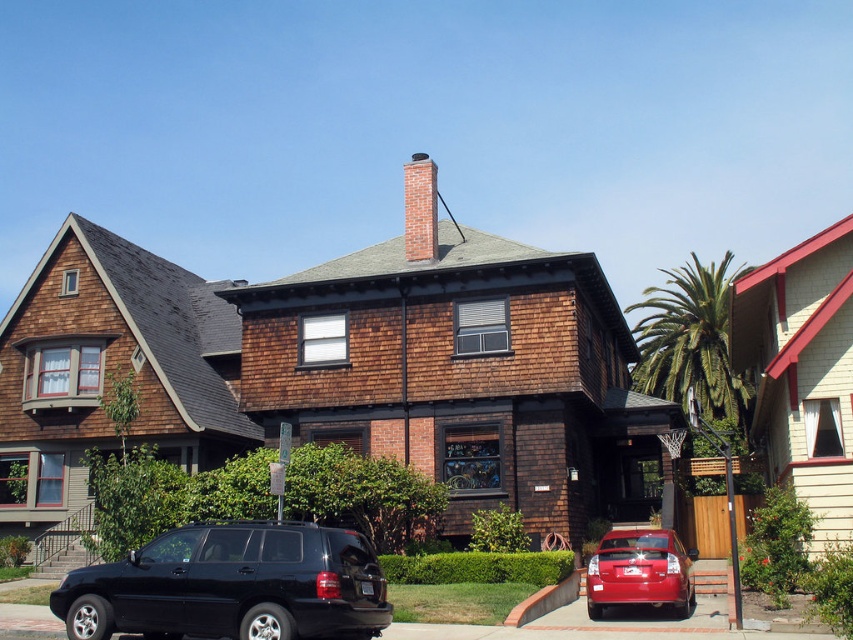
You are standing at the entrance of the house and want to move to the shiny red sedan at lower right. Is the black SUV on the left blocking your path? Please explain.

The black SUV on the left is parked 31.31 meters away from the shiny red sedan at lower right. Since the distance between them is significant, the black SUV is not blocking the path to the shiny red sedan at lower right.

You are a delivery person trying to access the house entrance. The black matte suv at lower left and the shiny red sedan at lower right are blocking the path. Which vehicle should you move first to clear the path?

The black matte suv at lower left is in front of the shiny red sedan at lower right, so you should move the black matte suv at lower left first to allow access to the house entrance.

You are standing in front of the house and want to locate two specific points marked in the image. Which point, point (x=138, y=612) or point (x=421, y=246), is closer to you?

Point (x=138, y=612) is closer to the viewer than point (x=421, y=246).